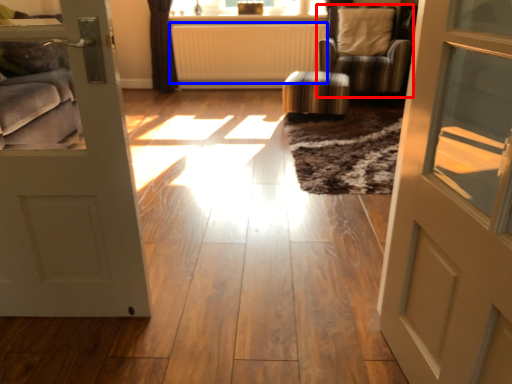
Question: Which point is closer to the camera, chair (highlighted by a red box) or radiator (highlighted by a blue box)?

Choices:
 (A) chair
 (B) radiator

Answer: (A)